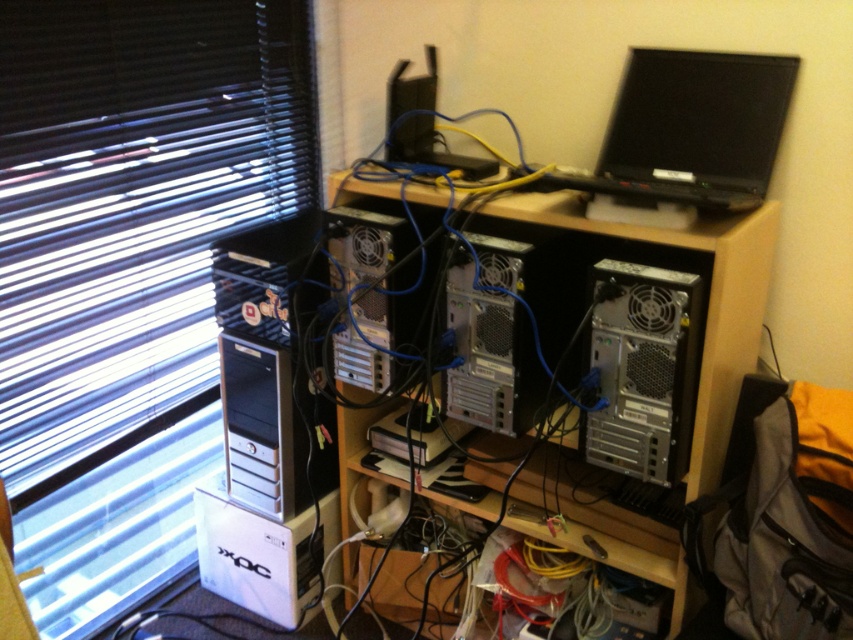
You are setting up a new desk and need to place both the sleek silver tower at center and the black plastic speaker at center. Given their sizes, which object should you place first to ensure there is enough space for both?

Since the sleek silver tower at center is larger in size than the black plastic speaker at center, you should place the sleek silver tower at center first to ensure there is enough space for both.

You are organizing cables on the desk and need to find the sleek silver tower at center. According to the coordinates provided, where exactly is the sleek silver tower located?

The sleek silver tower at center is located at point coordinates of (496, 332).

You need to place both the black glossy laptop at upper right and the black plastic speaker at center on a shelf that can only hold items up to 50 cm in width. Given their sizes, can both items fit side by side on the shelf?

The black glossy laptop at upper right is wider than the black plastic speaker at center. However, without knowing their exact widths, it is impossible to determine if their combined width exceeds 50 cm. More information is needed to answer this question.